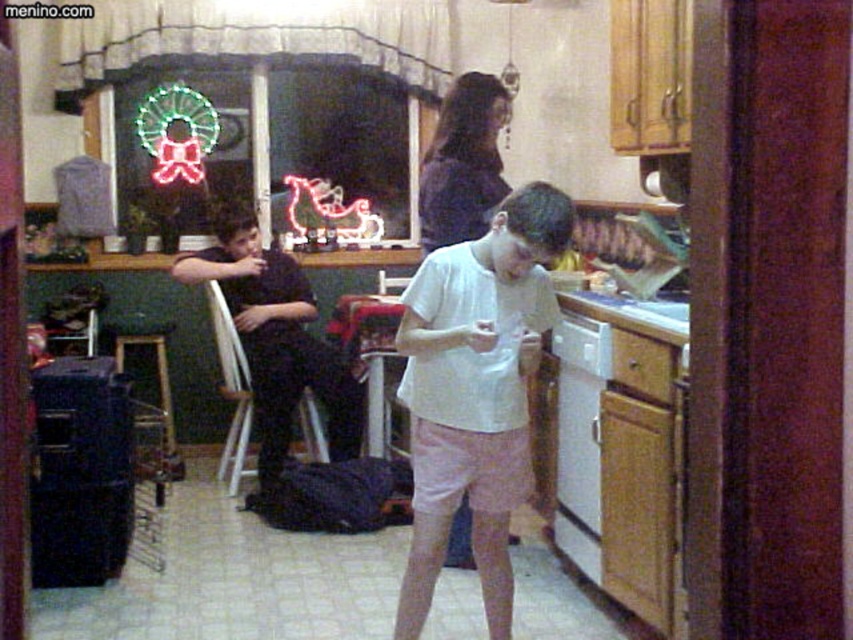
Question: Does dark purple blouse at center have a larger size compared to white plastic dishwasher at lower center?

Choices:
 (A) yes
 (B) no

Answer: (A)

Question: Is dark purple blouse at center further to camera compared to white plastic dishwasher at lower center?

Choices:
 (A) yes
 (B) no

Answer: (A)

Question: Which point is closer to the camera?

Choices:
 (A) white cotton shirt at center
 (B) black cotton shirt at left
 (C) dark purple blouse at center

Answer: (A)

Question: Which object is the farthest from the white cotton shirt at center?

Choices:
 (A) white plastic dishwasher at lower center
 (B) dark purple blouse at center

Answer: (B)

Question: Which of the following is the closest to the observer?

Choices:
 (A) black cotton shirt at left
 (B) dark purple blouse at center

Answer: (B)

Question: Is white cotton shirt at center positioned behind dark purple blouse at center?

Choices:
 (A) no
 (B) yes

Answer: (A)